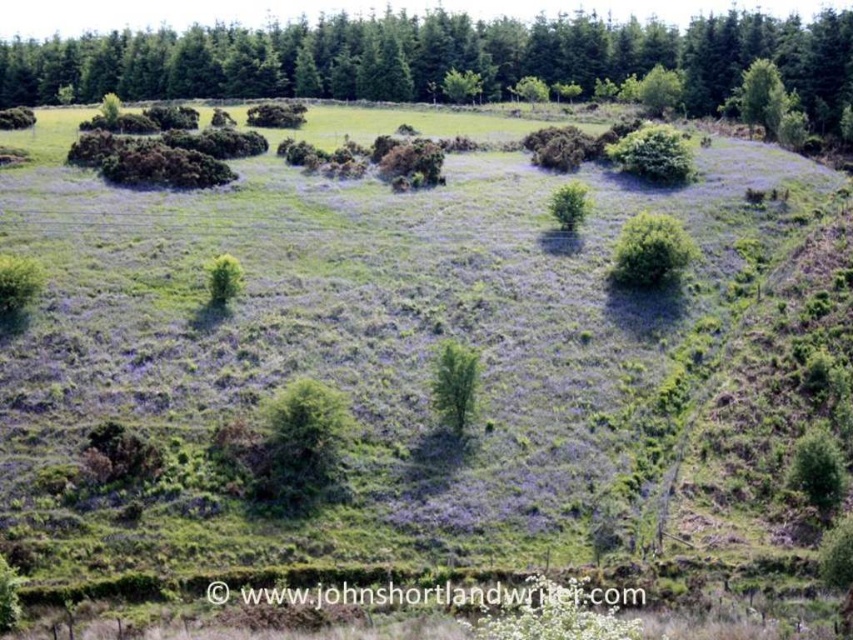
Question: Does green leafy bush at center appear on the left side of green leafy tree at center?

Choices:
 (A) no
 (B) yes

Answer: (A)

Question: Considering the relative positions of green leafy tree at upper center and green leafy bush at center in the image provided, where is green leafy tree at upper center located with respect to green leafy bush at center?

Choices:
 (A) above
 (B) below

Answer: (A)

Question: Can you confirm if green leafy tree at upper center is positioned to the right of green leafy bush at center?

Choices:
 (A) no
 (B) yes

Answer: (A)

Question: Which of these objects is positioned farthest from the green leafy tree at center?

Choices:
 (A) green leafy bush at center
 (B) green leafy tree at upper center

Answer: (B)

Question: Which of the following is the closest to the observer?

Choices:
 (A) (837, 124)
 (B) (635, 278)
 (C) (440, 374)

Answer: (C)

Question: Which of the following is the closest to the observer?

Choices:
 (A) green leafy bush at center
 (B) green leafy tree at upper center

Answer: (A)